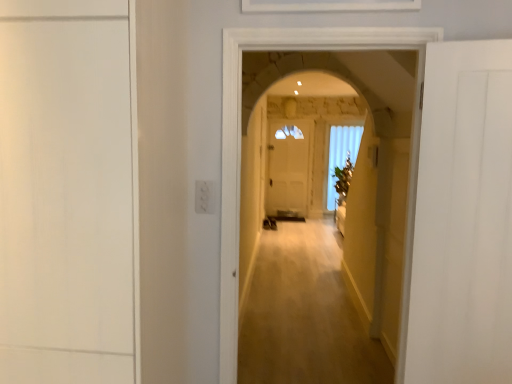
Question: Can we say white matte door at right, acting as the 1th door starting from the right, lies outside white glass window at center?

Choices:
 (A) no
 (B) yes

Answer: (B)

Question: From the image's perspective, does white matte door at right, the second door from the left, appear higher than white glass window at center?

Choices:
 (A) yes
 (B) no

Answer: (B)

Question: Could you tell me if white matte door at right, acting as the 1th door starting from the right, is turned towards white glass window at center?

Choices:
 (A) no
 (B) yes

Answer: (A)

Question: Are white matte door at right, the second door from the left, and white glass window at center making contact?

Choices:
 (A) no
 (B) yes

Answer: (A)

Question: Is white matte door at right, the second door from the left, shorter than white glass window at center?

Choices:
 (A) no
 (B) yes

Answer: (B)

Question: In the image, is white glass window at center on the left side or the right side of white matte door at right, the second door from the left?

Choices:
 (A) right
 (B) left

Answer: (A)

Question: In terms of height, does white glass window at center look taller or shorter compared to white matte door at right, acting as the 1th door starting from the right?

Choices:
 (A) short
 (B) tall

Answer: (B)

Question: Is white glass window at center bigger or smaller than white matte door at right, the second door from the left?

Choices:
 (A) small
 (B) big

Answer: (B)

Question: From the image's perspective, is white glass window at center positioned above or below white matte door at right, acting as the 1th door starting from the right?

Choices:
 (A) below
 (B) above

Answer: (B)

Question: Would you say white matte door at right, the second door from the left, is to the left or to the right of white glass window at center in the picture?

Choices:
 (A) right
 (B) left

Answer: (B)

Question: Considering the positions of white matte door at right, the second door from the left, and white glass window at center in the image, is white matte door at right, the second door from the left, taller or shorter than white glass window at center?

Choices:
 (A) tall
 (B) short

Answer: (B)

Question: From a real-world perspective, is white matte door at right, the second door from the left, positioned above or below white glass window at center?

Choices:
 (A) above
 (B) below

Answer: (A)

Question: Is point (454, 283) closer or farther from the camera than point (328, 193)?

Choices:
 (A) closer
 (B) farther

Answer: (A)

Question: Is point (315, 29) positioned closer to the camera than point (446, 276)?

Choices:
 (A) farther
 (B) closer

Answer: (B)

Question: Which is correct: wooden floor at center is inside white matte door at right, acting as the 1th door starting from the right, or outside of it?

Choices:
 (A) inside
 (B) outside

Answer: (B)